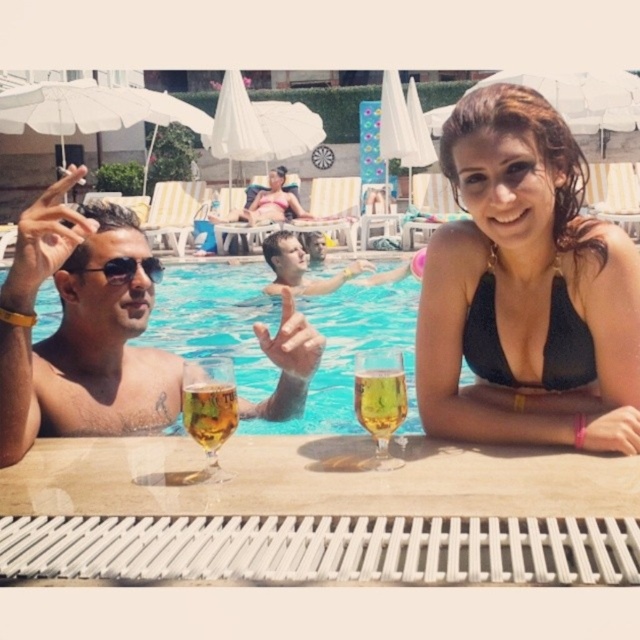
You are a photographer standing at the edge of the pool. You want to take a photo of the black matte bikini at upper right and the person on the left. How far apart are they in the image?

They are 1.25 meters apart.

You are a photographer trying to capture a group photo of the black matte bikini at upper right and the shiny metallic man at left. Considering their sizes, which one should you position closer to the camera to ensure both appear balanced in the photo?

The black matte bikini at upper right is bigger than the shiny metallic man at left, so you should position the shiny metallic man at left closer to the camera to balance their sizes in the photo.

You are a bartender at the poolside. You need to place both the transparent glass water at center and the translucent glass wine glass at lower center on a shelf. Which one should you place first to avoid knocking over the other?

You should place the translucent glass wine glass at lower center first because it is located below the transparent glass water at center, so placing the lower one first ensures stability and prevents the upper glass from knocking it over.